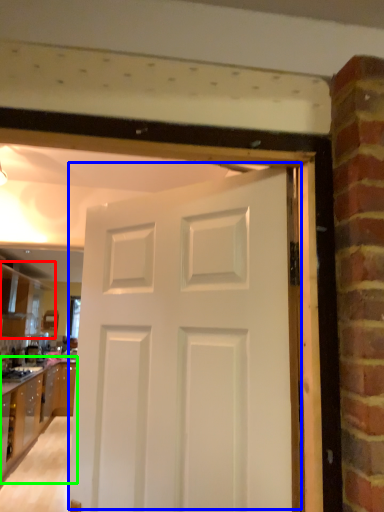
Question: Based on their relative distances, which object is nearer to cabinetry (highlighted by a red box)? Choose from door (highlighted by a blue box) and cabinetry (highlighted by a green box).

Choices:
 (A) door
 (B) cabinetry

Answer: (B)